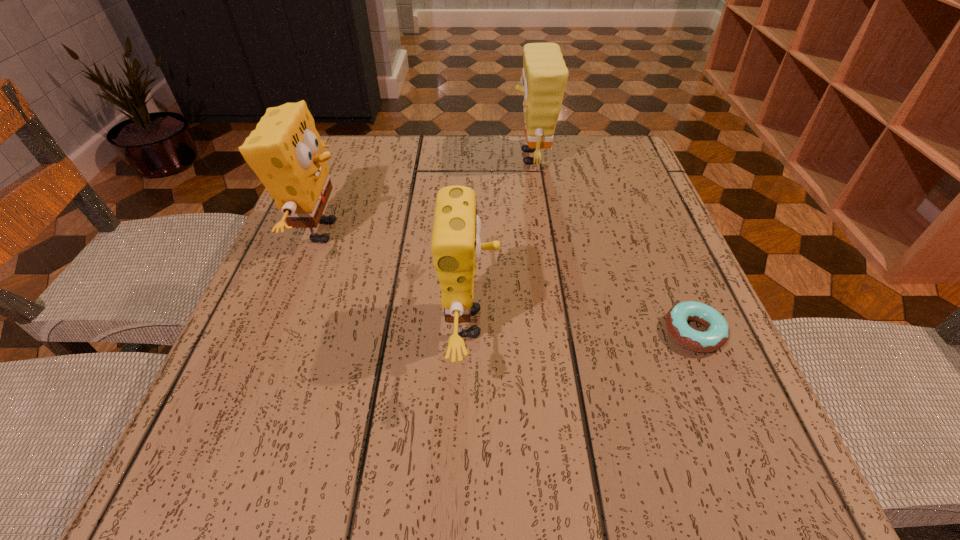
Image resolution: width=960 pixels, height=540 pixels. Find the location of `empty space between the rightmost object and the second sponge from left to right`. empty space between the rightmost object and the second sponge from left to right is located at coordinates (582, 327).

Locate an element on the screen. This screenshot has height=540, width=960. unoccupied area between the leftmost sponge and the third object from left to right is located at coordinates (426, 194).

This screenshot has height=540, width=960. I want to click on free space between the second object from left to right and the leftmost sponge, so click(396, 277).

The image size is (960, 540). I want to click on blank region between the second object from left to right and the rightmost object, so click(x=582, y=327).

This screenshot has width=960, height=540. I want to click on vacant area that lies between the shortest object and the second object from left to right, so click(x=582, y=327).

This screenshot has width=960, height=540. Find the location of `free space between the shortest object and the second sponge from right to left`. free space between the shortest object and the second sponge from right to left is located at coordinates (582, 327).

Locate an element on the screen. This screenshot has width=960, height=540. free area in between the farthest sponge and the shortest object is located at coordinates (612, 245).

Locate an element on the screen. free space that is in between the rightmost object and the second sponge from right to left is located at coordinates (582, 327).

This screenshot has width=960, height=540. In order to click on free point between the second object from left to right and the farthest object in this screenshot , I will do `click(501, 240)`.

The width and height of the screenshot is (960, 540). Find the location of `empty space between the rightmost sponge and the rightmost object`. empty space between the rightmost sponge and the rightmost object is located at coordinates (612, 245).